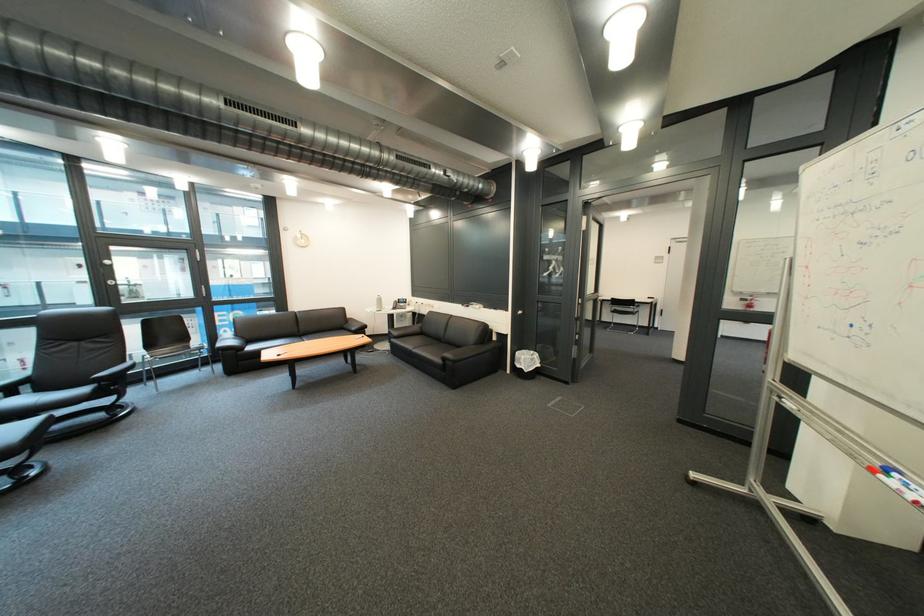
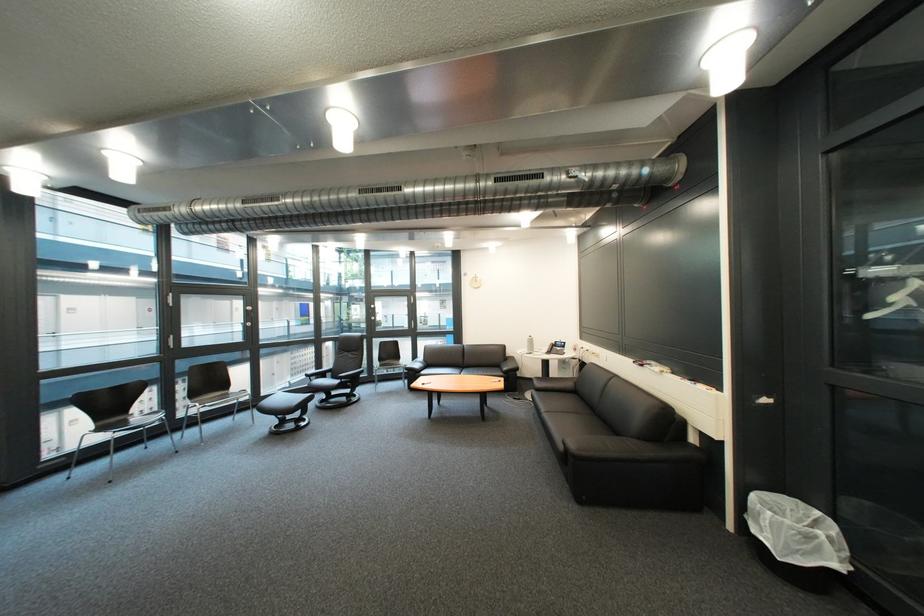
Locate, in the second image, the point that corresponds to point 234,346 in the first image.

(423, 367)